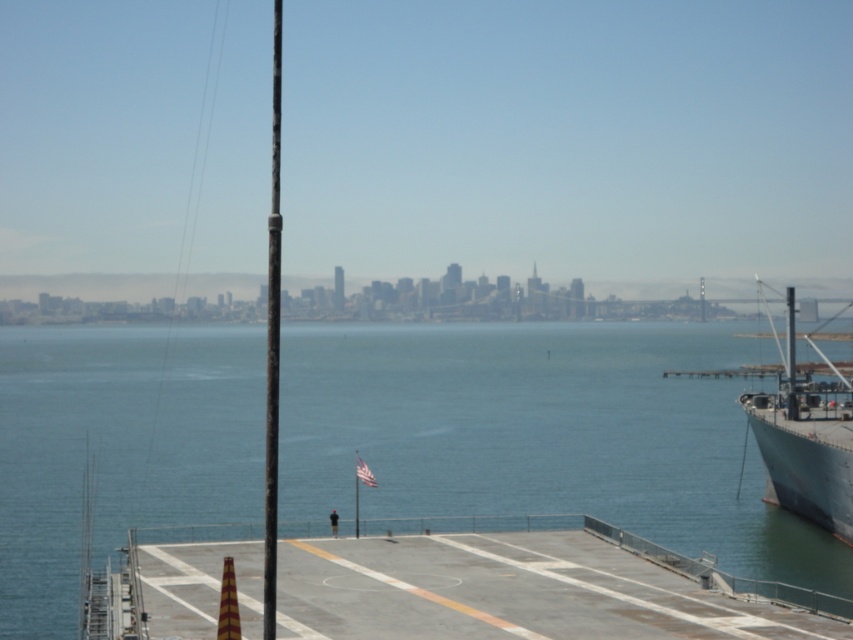
Identify the location of gray metallic ship at right. Image resolution: width=853 pixels, height=640 pixels. (805, 440).

Is blue water at center above smooth black pole at center?

Actually, blue water at center is below smooth black pole at center.

Looking at this image, can you confirm if blue water at center is positioned below smooth black pole at center?

Correct, blue water at center is located below smooth black pole at center.

What are the coordinates of `blue water at center` in the screenshot? It's located at (541, 435).

Does point (750, 573) come in front of point (335, 540)?

No, it is not.

Is point (175, 493) behind point (537, 580)?

Yes.

Is point (119, 380) positioned before point (688, 563)?

No, (119, 380) is behind (688, 563).

Find the location of `blue water at center`. blue water at center is located at coordinates (541, 435).